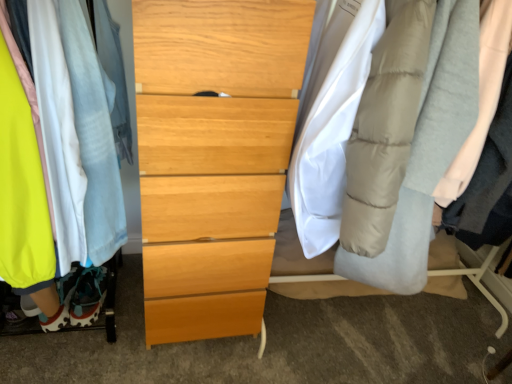
Question: Is light wood chest of drawers at center completely or partially outside of light gray quilted robe at right, which appears as the 2th robe when viewed from the left?

Choices:
 (A) yes
 (B) no

Answer: (A)

Question: From a real-world perspective, is light wood chest of drawers at center physically above light gray quilted robe at right, which appears as the 2th robe when viewed from the left?

Choices:
 (A) yes
 (B) no

Answer: (B)

Question: Would you consider light wood chest of drawers at center to be distant from light gray quilted robe at right, which appears as the 2th robe when viewed from the left?

Choices:
 (A) no
 (B) yes

Answer: (A)

Question: Is light wood chest of drawers at center further to camera compared to light gray quilted robe at right, which appears as the 2th robe when viewed from the left?

Choices:
 (A) no
 (B) yes

Answer: (B)

Question: Is light wood chest of drawers at center in front of light gray quilted robe at right, the first robe in the right-to-left sequence?

Choices:
 (A) no
 (B) yes

Answer: (A)

Question: Considering the relative sizes of light wood chest of drawers at center and light gray quilted robe at right, which appears as the 2th robe when viewed from the left, in the image provided, is light wood chest of drawers at center taller than light gray quilted robe at right, which appears as the 2th robe when viewed from the left,?

Choices:
 (A) no
 (B) yes

Answer: (B)

Question: Is matte fabric clothes at left smaller than light gray quilted robe at right, the first robe in the right-to-left sequence?

Choices:
 (A) yes
 (B) no

Answer: (B)

Question: Could light gray quilted robe at right, the first robe in the right-to-left sequence, be considered to be inside matte fabric clothes at left?

Choices:
 (A) no
 (B) yes

Answer: (A)

Question: Is matte fabric clothes at left at the right side of light gray quilted robe at right, which appears as the 2th robe when viewed from the left?

Choices:
 (A) no
 (B) yes

Answer: (A)

Question: From the image's perspective, is matte fabric clothes at left located beneath light gray quilted robe at right, which appears as the 2th robe when viewed from the left?

Choices:
 (A) no
 (B) yes

Answer: (A)

Question: Is matte fabric clothes at left behind light gray quilted robe at right, which appears as the 2th robe when viewed from the left?

Choices:
 (A) no
 (B) yes

Answer: (A)

Question: Would you say matte fabric clothes at left is outside light gray quilted robe at right, which appears as the 2th robe when viewed from the left?

Choices:
 (A) no
 (B) yes

Answer: (B)

Question: Is matte fabric clothes at left positioned in front of light wood chest of drawers at center?

Choices:
 (A) no
 (B) yes

Answer: (B)